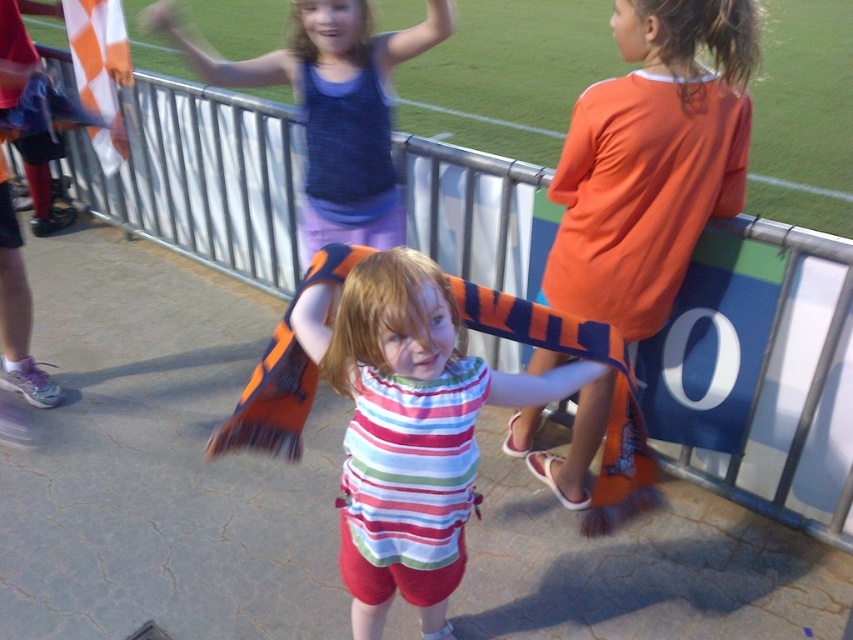
Question: Considering the relative positions of orange jersey at upper right and matte blue tank top at upper center in the image provided, where is orange jersey at upper right located with respect to matte blue tank top at upper center?

Choices:
 (A) left
 (B) right

Answer: (B)

Question: Among these points, which one is farthest from the camera?

Choices:
 (A) (584, 378)
 (B) (595, 266)

Answer: (B)

Question: Which of the following is the closest to the observer?

Choices:
 (A) (178, 45)
 (B) (607, 184)

Answer: (B)

Question: Considering the relative positions of orange jersey at upper right and matte blue tank top at upper center in the image provided, where is orange jersey at upper right located with respect to matte blue tank top at upper center?

Choices:
 (A) right
 (B) left

Answer: (A)

Question: Which object is closer to the camera taking this photo?

Choices:
 (A) matte blue tank top at upper center
 (B) orange jersey at upper right

Answer: (B)

Question: Is striped cotton shirt at center positioned before matte blue tank top at upper center?

Choices:
 (A) yes
 (B) no

Answer: (A)